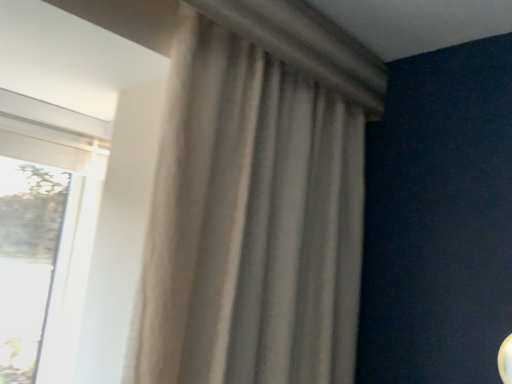
Question: In terms of height, does beige fabric curtain at center look taller or shorter compared to transparent glass window at left?

Choices:
 (A) tall
 (B) short

Answer: (A)

Question: Does point (169, 246) appear closer or farther from the camera than point (13, 352)?

Choices:
 (A) farther
 (B) closer

Answer: (B)

Question: Based on their sizes in the image, would you say beige fabric curtain at center is bigger or smaller than transparent glass window at left?

Choices:
 (A) small
 (B) big

Answer: (B)

Question: Would you say transparent glass window at left is to the left or to the right of beige fabric curtain at center in the picture?

Choices:
 (A) right
 (B) left

Answer: (B)

Question: In terms of size, does transparent glass window at left appear bigger or smaller than beige fabric curtain at center?

Choices:
 (A) small
 (B) big

Answer: (A)

Question: In terms of height, does transparent glass window at left look taller or shorter compared to beige fabric curtain at center?

Choices:
 (A) tall
 (B) short

Answer: (B)

Question: Is point (20, 213) positioned closer to the camera than point (203, 150)?

Choices:
 (A) farther
 (B) closer

Answer: (A)